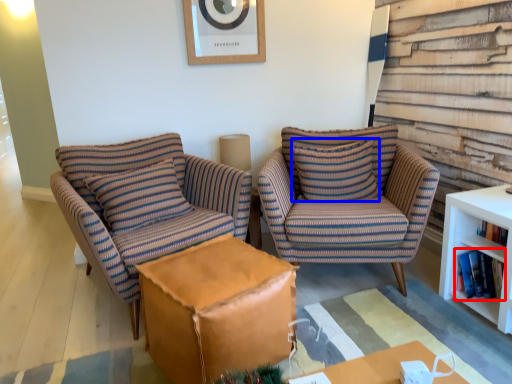
Question: Which object appears farthest to the camera in this image, book (highlighted by a red box) or pillow (highlighted by a blue box)?

Choices:
 (A) book
 (B) pillow

Answer: (B)